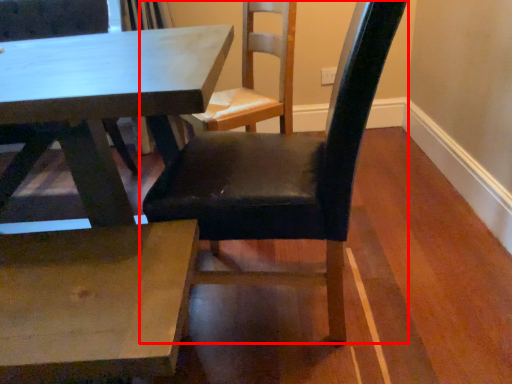
Question: Observing the image, what is the correct spatial positioning of chair (annotated by the red box) in reference to table?

Choices:
 (A) right
 (B) left

Answer: (A)